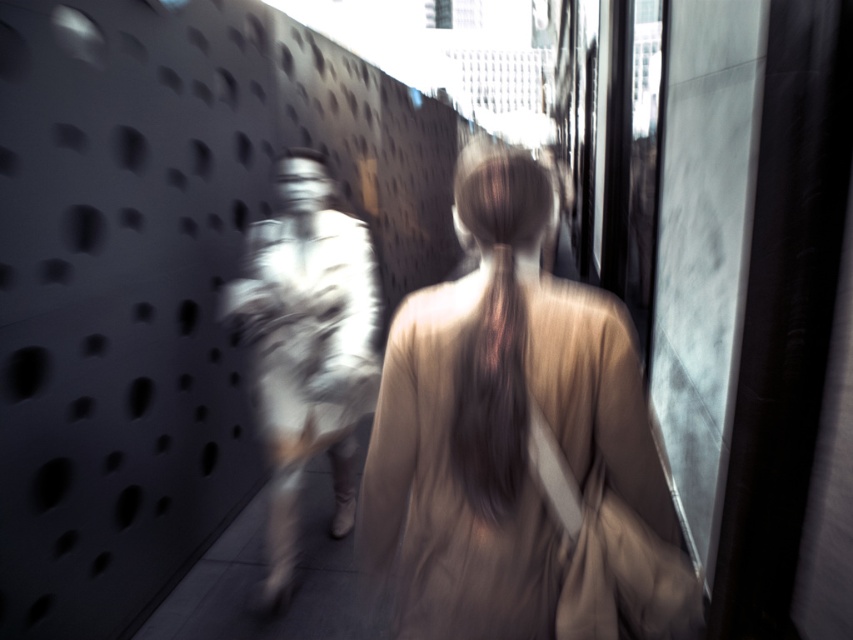
Question: Considering the relative positions of matte beige dress at center and white fabric dress at center in the image provided, where is matte beige dress at center located with respect to white fabric dress at center?

Choices:
 (A) left
 (B) right

Answer: (B)

Question: Is matte beige dress at center wider than white fabric dress at center?

Choices:
 (A) yes
 (B) no

Answer: (B)

Question: Is the position of matte beige dress at center less distant than that of white fabric dress at center?

Choices:
 (A) yes
 (B) no

Answer: (A)

Question: Which point appears farthest from the camera in this image?

Choices:
 (A) (257, 333)
 (B) (476, 305)

Answer: (A)

Question: Which of the following is the farthest from the observer?

Choices:
 (A) white fabric dress at center
 (B) matte beige dress at center

Answer: (A)